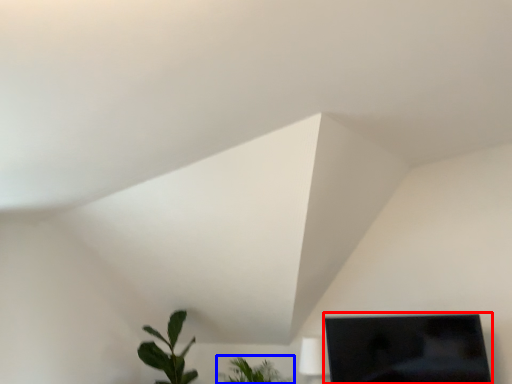
Question: Among these objects, which one is nearest to the camera, computer monitor (highlighted by a red box) or houseplant (highlighted by a blue box)?

Choices:
 (A) computer monitor
 (B) houseplant

Answer: (A)